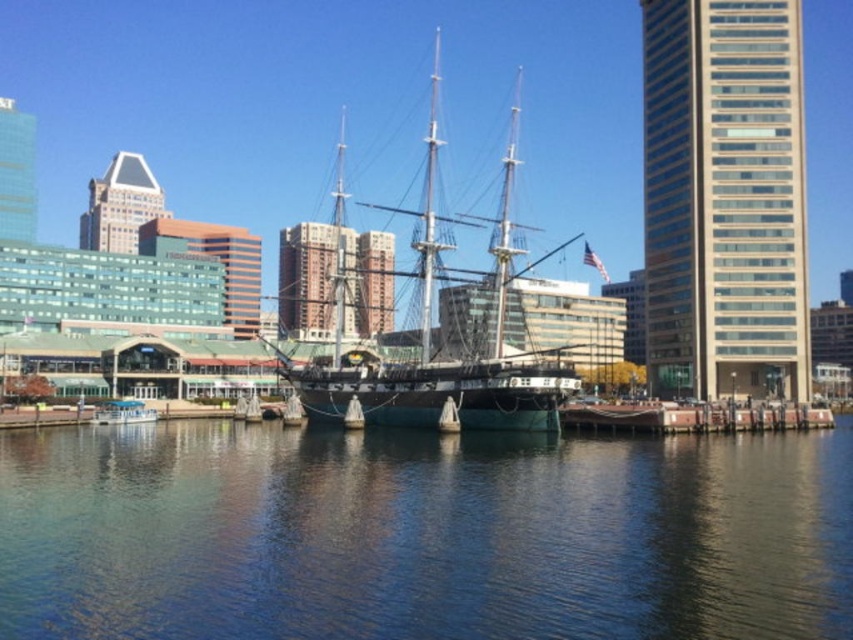
Question: Is teal wooden ship at center below green wooden boat at lower center?

Choices:
 (A) yes
 (B) no

Answer: (B)

Question: Which object is farther from the camera taking this photo?

Choices:
 (A) blue water at center
 (B) green wooden boat at lower center
 (C) teal wooden ship at center

Answer: (B)

Question: Among these points, which one is nearest to the camera?

Choices:
 (A) (844, 545)
 (B) (506, 244)
 (C) (107, 408)

Answer: (A)

Question: Which is nearer to the blue water at center?

Choices:
 (A) teal wooden ship at center
 (B) green wooden boat at lower center

Answer: (B)

Question: Is blue water at center to the right of teal wooden ship at center from the viewer's perspective?

Choices:
 (A) no
 (B) yes

Answer: (A)

Question: Does teal wooden ship at center have a larger size compared to green wooden boat at lower center?

Choices:
 (A) yes
 (B) no

Answer: (A)